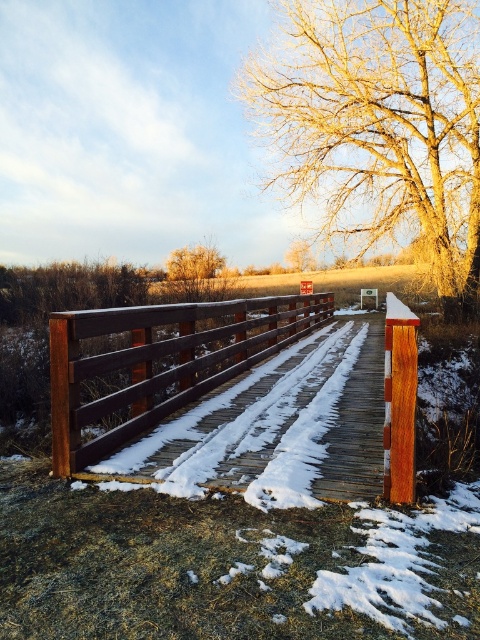
Question: Does golden textured tree at upper right appear over bare brown tree at upper center?

Choices:
 (A) no
 (B) yes

Answer: (B)

Question: Can you confirm if golden textured tree at upper right is positioned to the right of bare brown tree at upper center?

Choices:
 (A) yes
 (B) no

Answer: (A)

Question: Which point is farther to the camera?

Choices:
 (A) (443, 3)
 (B) (301, 240)
 (C) (170, 275)
 (D) (129, 326)

Answer: (B)

Question: Is golden textured tree at upper right thinner than brown wooden bridge at center?

Choices:
 (A) no
 (B) yes

Answer: (A)

Question: Among these points, which one is farthest from the camera?

Choices:
 (A) (218, 264)
 (B) (82, 412)

Answer: (A)

Question: Which point is farther to the camera?

Choices:
 (A) (155, 352)
 (B) (189, 275)
 (C) (356, 45)

Answer: (B)